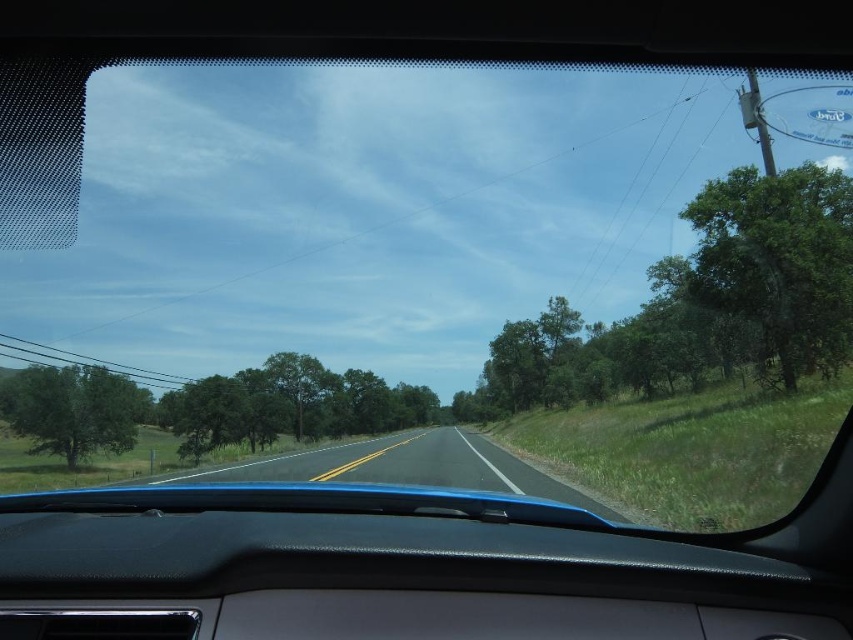
Question: Which point is closer to the camera?

Choices:
 (A) (96, 433)
 (B) (711, 301)

Answer: (B)

Question: Does asphalt road at center appear on the left side of green leafy tree at left?

Choices:
 (A) no
 (B) yes

Answer: (A)

Question: Can you confirm if green leafy tree at right is positioned above asphalt road at center?

Choices:
 (A) yes
 (B) no

Answer: (A)

Question: Which point is farther to the camera?

Choices:
 (A) green leafy tree at right
 (B) asphalt road at center
 (C) green leafy tree at left

Answer: (C)

Question: Based on their relative distances, which object is nearer to the green leafy tree at right?

Choices:
 (A) asphalt road at center
 (B) green leafy tree at left

Answer: (A)

Question: Can you confirm if asphalt road at center is thinner than green leafy tree at left?

Choices:
 (A) yes
 (B) no

Answer: (B)